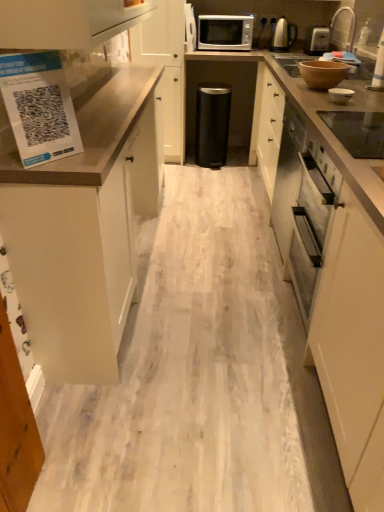
Question: Should I look upward or downward to see brown matte bowl at upper right, positioned as the third appliance in back-to-front order?

Choices:
 (A) down
 (B) up

Answer: (B)

Question: Is white matte cabinet at left, acting as the 1th cabinetry starting from the front, next to black glass cooktop at upper right, arranged as the fifth appliance when viewed from the top, and touching it?

Choices:
 (A) yes
 (B) no

Answer: (B)

Question: Is white matte cabinet at left, acting as the 1th cabinetry starting from the front, facing away from black glass cooktop at upper right, placed as the 2th appliance when sorted from left to right?

Choices:
 (A) no
 (B) yes

Answer: (A)

Question: Is white matte cabinet at left, acting as the 1th cabinetry starting from the front, thinner than black glass cooktop at upper right, which is counted as the fourth appliance, starting from the right?

Choices:
 (A) no
 (B) yes

Answer: (A)

Question: Is white matte cabinet at left, acting as the 1th cabinetry starting from the front, taller than black glass cooktop at upper right, which ranks as the 1th appliance in bottom-to-top order?

Choices:
 (A) yes
 (B) no

Answer: (A)

Question: From the image's perspective, would you say white matte cabinet at left, acting as the 1th cabinetry starting from the front, is positioned over black glass cooktop at upper right, arranged as the fifth appliance when viewed from the top?

Choices:
 (A) yes
 (B) no

Answer: (B)

Question: Can you confirm if white matte cabinet at left, the 2th cabinetry when ordered from back to front, is positioned to the left of black glass cooktop at upper right, the fifth appliance positioned from the back?

Choices:
 (A) yes
 (B) no

Answer: (A)

Question: Is brown matte countertop at right placed right next to white matte cabinet at center, which ranks as the 2th cabinetry in front-to-back order?

Choices:
 (A) yes
 (B) no

Answer: (B)

Question: Considering the relative sizes of brown matte countertop at right and white matte cabinet at center, which ranks as the 2th cabinetry in front-to-back order, in the image provided, is brown matte countertop at right taller than white matte cabinet at center, which ranks as the 2th cabinetry in front-to-back order,?

Choices:
 (A) no
 (B) yes

Answer: (A)

Question: Can you confirm if brown matte countertop at right is wider than white matte cabinet at center, arranged as the first cabinetry when viewed from the back?

Choices:
 (A) yes
 (B) no

Answer: (A)

Question: From a real-world perspective, is brown matte countertop at right on top of white matte cabinet at center, arranged as the first cabinetry when viewed from the back?

Choices:
 (A) no
 (B) yes

Answer: (A)

Question: Considering the relative positions of brown matte countertop at right and white matte cabinet at center, which ranks as the 2th cabinetry in front-to-back order, in the image provided, is brown matte countertop at right to the right of white matte cabinet at center, which ranks as the 2th cabinetry in front-to-back order, from the viewer's perspective?

Choices:
 (A) yes
 (B) no

Answer: (A)

Question: Does brown matte countertop at right lie behind white matte cabinet at center, which ranks as the 2th cabinetry in front-to-back order?

Choices:
 (A) yes
 (B) no

Answer: (B)

Question: Are brown matte bowl at upper right, placed as the 3th appliance when sorted from right to left, and white glossy bowl at upper right, acting as the fourth appliance starting from the top, making contact?

Choices:
 (A) no
 (B) yes

Answer: (A)